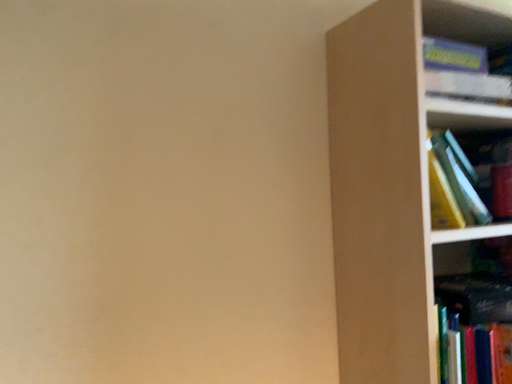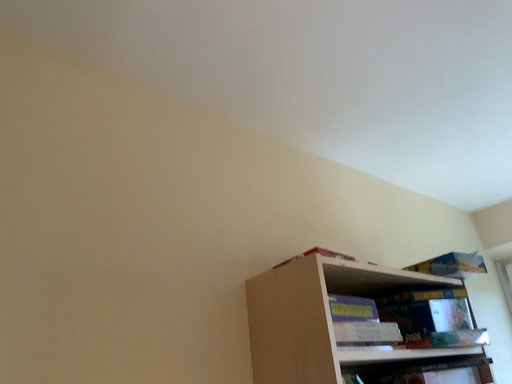
Question: Which way did the camera rotate in the video?

Choices:
 (A) rotated downward
 (B) rotated upward

Answer: (B)